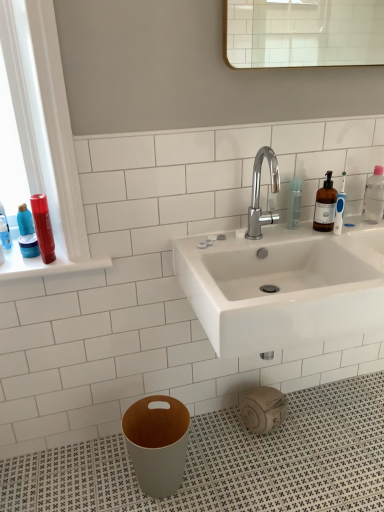
Question: Is point (294, 178) positioned closer to the camera than point (370, 199)?

Choices:
 (A) farther
 (B) closer

Answer: (B)

Question: Is clear plastic bottle at upper right situated inside clear plastic bottle at right or outside?

Choices:
 (A) outside
 (B) inside

Answer: (A)

Question: Based on their relative distances, which object is farther from the clear plastic bottle at right?

Choices:
 (A) clear plastic bottle at upper right
 (B) chrome metallic faucet at center
 (C) matte plastic bottles at left
 (D) shiny red hair spray at left
 (E) white glossy sink at center

Answer: (D)

Question: Based on their relative distances, which object is nearer to the shiny red hair spray at left?

Choices:
 (A) clear plastic bottle at upper right
 (B) matte plastic bottles at left
 (C) chrome metallic faucet at center
 (D) white glossy sink at center
 (E) clear plastic bottle at right

Answer: (B)